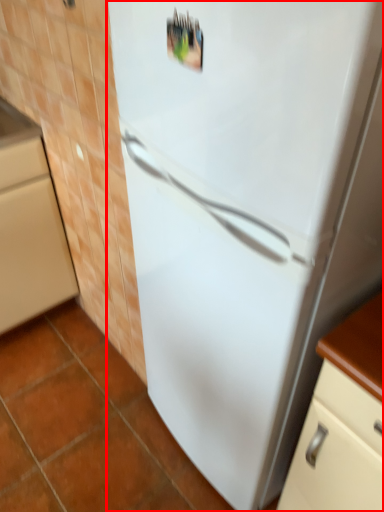
Question: Where is refrigerator (annotated by the red box) located in relation to cabinetry in the image?

Choices:
 (A) left
 (B) right

Answer: (B)